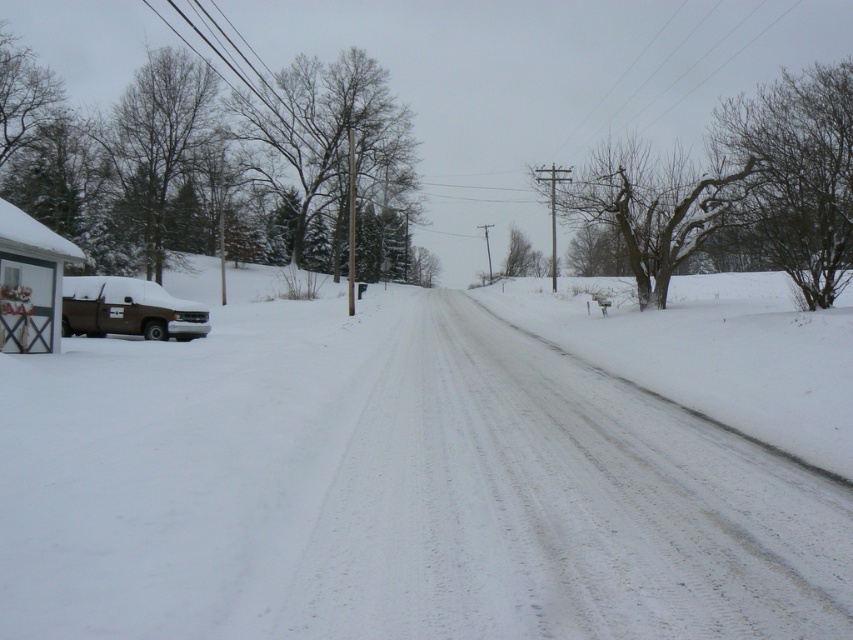
Question: Is white powdery snow at left below brown matte truck at left?

Choices:
 (A) no
 (B) yes

Answer: (B)

Question: Is white powdery snow at left below brown matte truck at left?

Choices:
 (A) yes
 (B) no

Answer: (A)

Question: Which object appears farthest from the camera in this image?

Choices:
 (A) brown matte truck at left
 (B) white powdery snow at left

Answer: (A)

Question: Which of the following is the farthest from the observer?

Choices:
 (A) white powdery snow at left
 (B) brown matte truck at left

Answer: (B)

Question: Which of the following is the closest to the observer?

Choices:
 (A) white powdery snow at left
 (B) brown matte truck at left

Answer: (A)

Question: In this image, where is white powdery snow at left located relative to brown matte truck at left?

Choices:
 (A) left
 (B) right

Answer: (B)